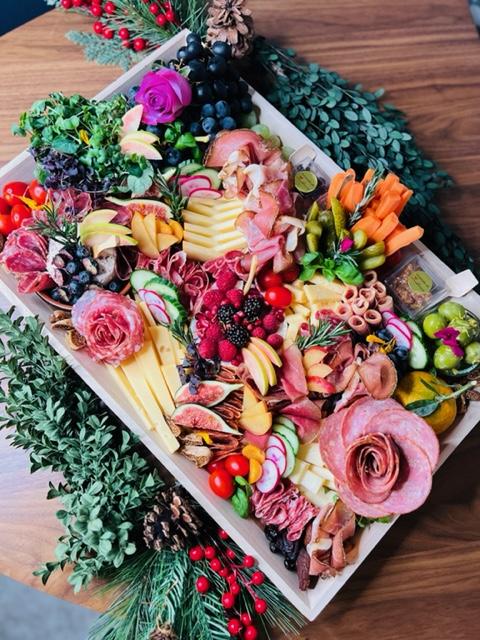
Where is `grey/black floor`? The width and height of the screenshot is (480, 640). grey/black floor is located at coordinates (34, 616).